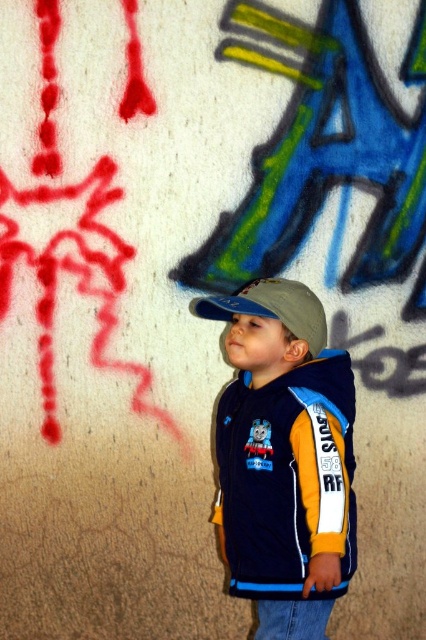
You are a photographer trying to capture a closeup of the matte blue cap at center and the matte gray baseball cap at center in the image. The camera lens has a maximum focus range of 10 inches. Will you be able to focus on both caps at the same time?

The matte blue cap at center and matte gray baseball cap at center are 10.47 inches apart from each other. Since the camera lens can only focus within 10 inches, the distance between them exceeds the maximum focus range. Therefore, you cannot focus on both caps simultaneously.

You are taking a photo of the graffiti on the wall. You notice two points marked on the wall. The first point is at coordinate point (299,604) and the second is at point (261,301). Which point will appear larger in your photo?

Point (299,604) is closer to the camera than point (261,301), so it will appear larger in the photo.